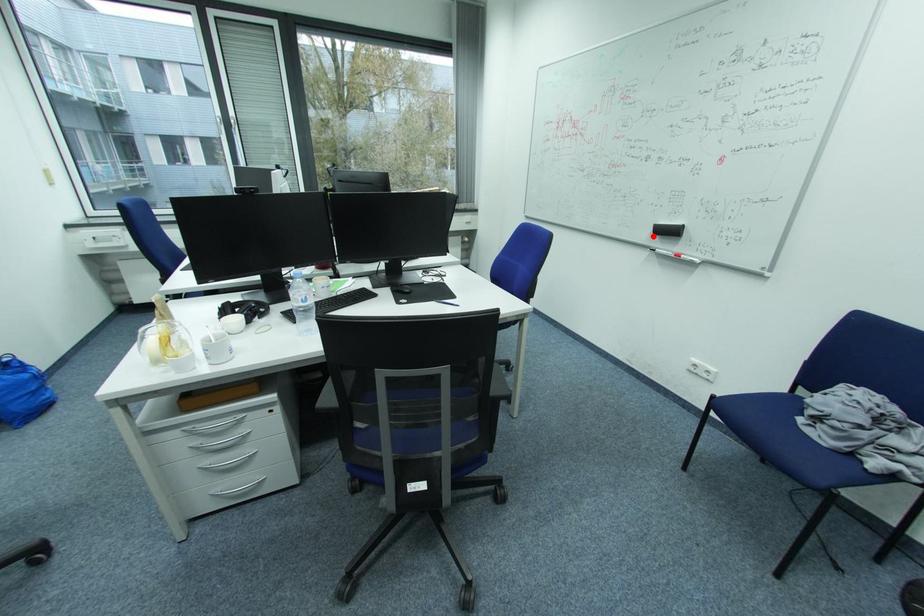
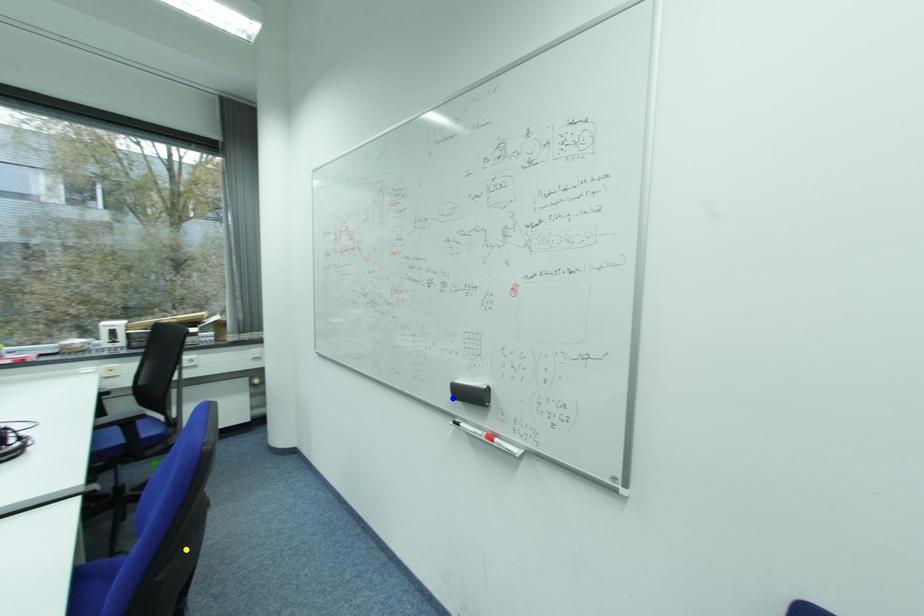
Question: I am providing you with two images of the same scene from different viewpoints. A red point is marked on the first image. You are given multiple points on the second image. Which point in image 2 is actually the same real-world point as the red point in image 1?

Choices:
 (A) yellow point
 (B) green point
 (C) blue point

Answer: (C)